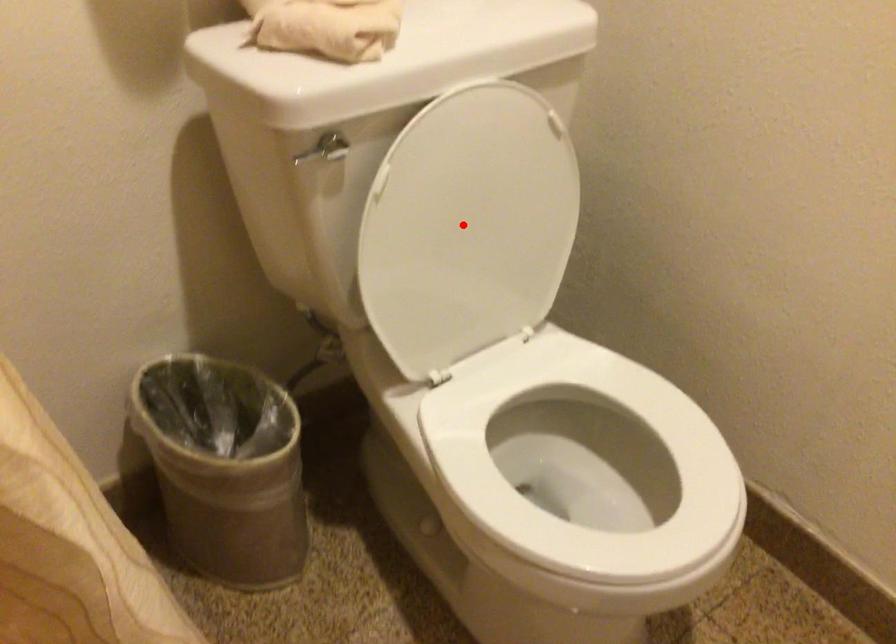
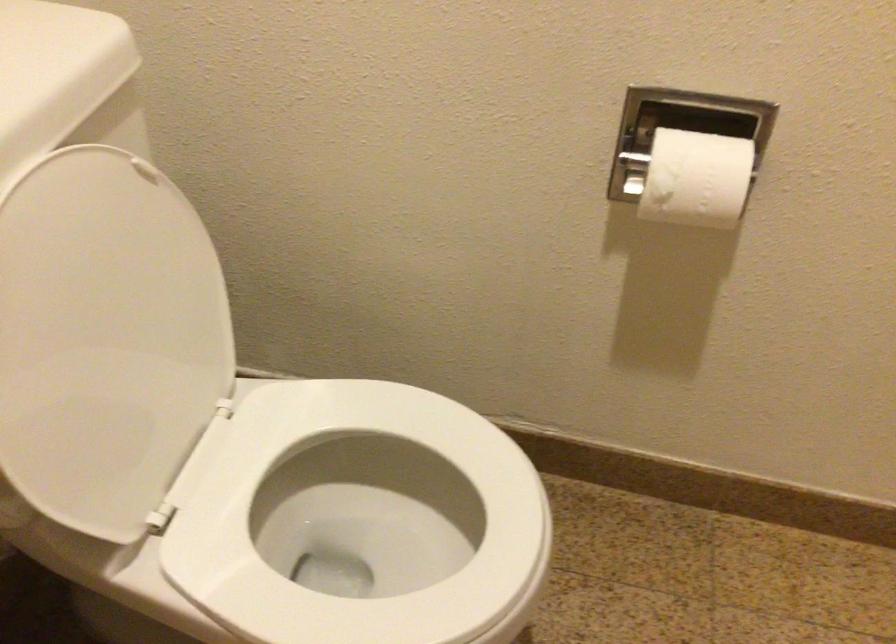
Question: I am providing you with two images of the same scene from different viewpoints. In image1, a red point is highlighted. Considering the same 3D point in image2, which of the following is correct?

Choices:
 (A) It is closer
 (B) It is farther

Answer: (A)